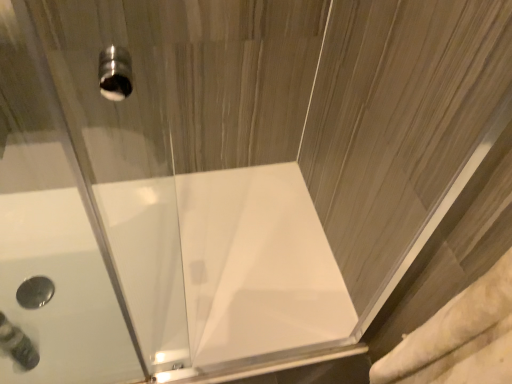
Describe the element at coordinates (226, 265) in the screenshot. I see `white glossy bath at center` at that location.

From the picture: Measure the distance between point (268, 189) and camera.

The distance of point (268, 189) from camera is 1.67 meters.

This screenshot has height=384, width=512. I want to click on white glossy bath at center, so click(226, 265).

This screenshot has height=384, width=512. In order to click on white glossy bath at center in this screenshot , I will do `click(226, 265)`.